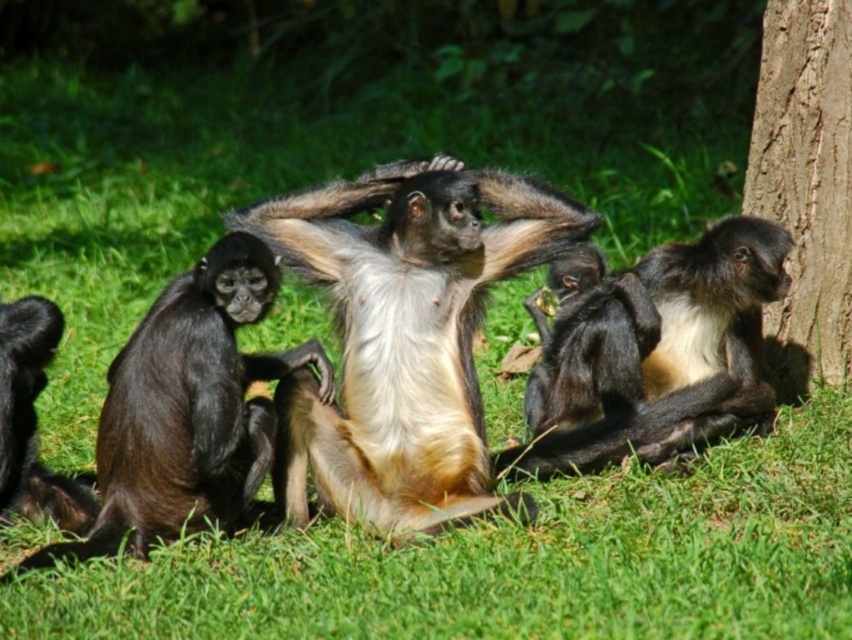
Question: Does shiny fur monkey at center have a greater width compared to black matte monkey at left?

Choices:
 (A) no
 (B) yes

Answer: (B)

Question: Which point is closer to the camera?

Choices:
 (A) brown rough bark tree at right
 (B) shiny fur monkey at center
 (C) black silky monkey at right

Answer: (B)

Question: Considering the relative positions of black silky monkey at right and black matte monkey at left in the image provided, where is black silky monkey at right located with respect to black matte monkey at left?

Choices:
 (A) right
 (B) left

Answer: (A)

Question: Which of the following is the closest to the observer?

Choices:
 (A) (41, 360)
 (B) (200, 497)

Answer: (B)

Question: Among these objects, which one is nearest to the camera?

Choices:
 (A) shiny fur monkey at center
 (B) black silky fur monkey at lower left

Answer: (A)

Question: Can you confirm if shiny fur monkey at center is positioned above black silky fur monkey at lower left?

Choices:
 (A) yes
 (B) no

Answer: (A)